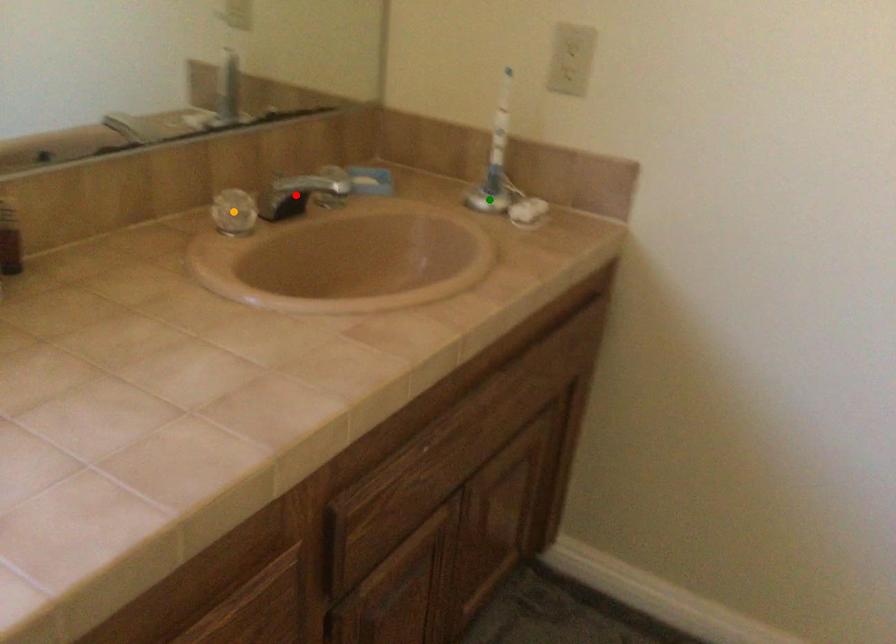
Order these from nearest to farthest:
orange point, red point, green point

1. orange point
2. red point
3. green point